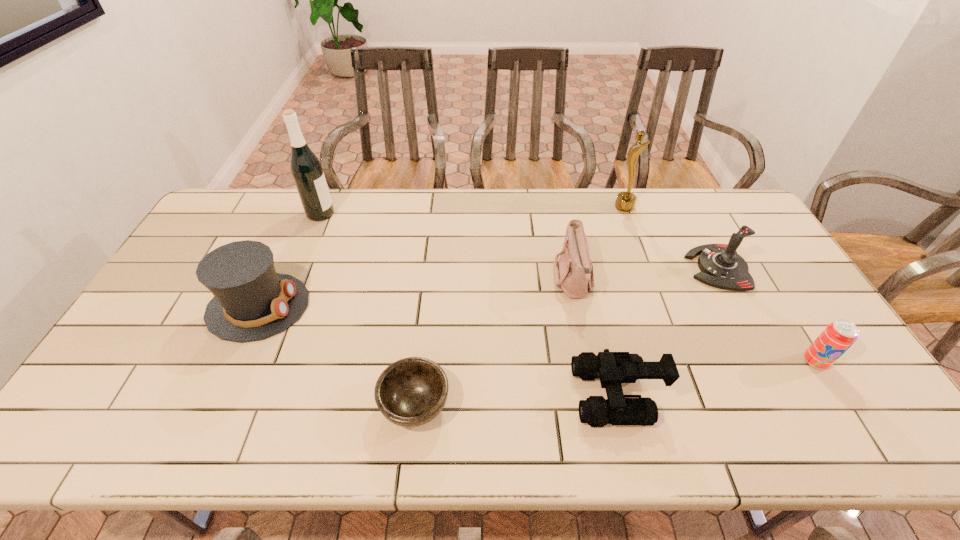
In order to click on free spot between the tallest object and the binoculars in this screenshot , I will do `click(468, 304)`.

Identify the location of unoccupied area between the binoculars and the second object from right to left. (667, 331).

This screenshot has width=960, height=540. I want to click on free space that is in between the binoculars and the bowl, so click(516, 400).

You are a GUI agent. You are given a task and a screenshot of the screen. Output one action in this format:
    pyautogui.click(x=<x>, y=<y>)
    Task: Click on the unoccupied area between the second object from right to left and the sixth object from left to right
    The image size is (960, 540).
    Given the screenshot: What is the action you would take?
    click(671, 237)

Where is `empty location between the joystick and the tallest object`? empty location between the joystick and the tallest object is located at coordinates (518, 241).

Image resolution: width=960 pixels, height=540 pixels. I want to click on free space that is in between the bowl and the dress hat, so click(337, 355).

Locate an element on the screen. vacant area that lies between the joystick and the dress hat is located at coordinates (488, 287).

Where is `object that is the seventh closest one to the shoulder bag`? object that is the seventh closest one to the shoulder bag is located at coordinates (306, 169).

Locate an element on the screen. object that stands as the closest to the award is located at coordinates (721, 266).

I want to click on free space that satisfies the following two spatial constraints: 1. on the label of the soda can; 2. on the left side of the wine bottle, so click(261, 361).